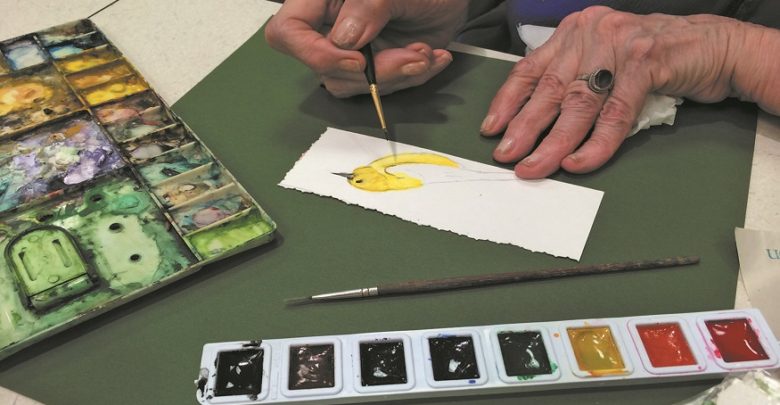
What are the coordinates of `orange paint` in the screenshot? It's located at pyautogui.click(x=656, y=343).